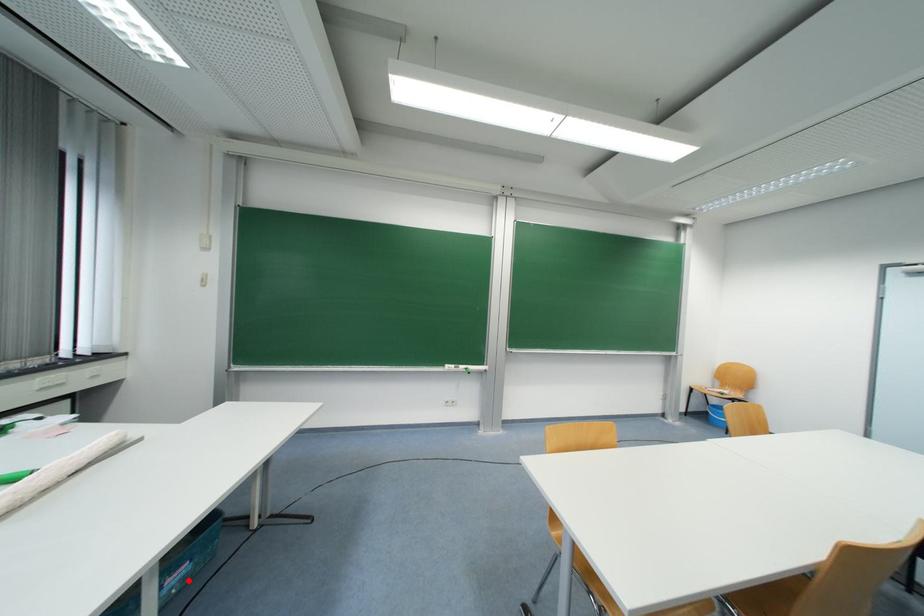
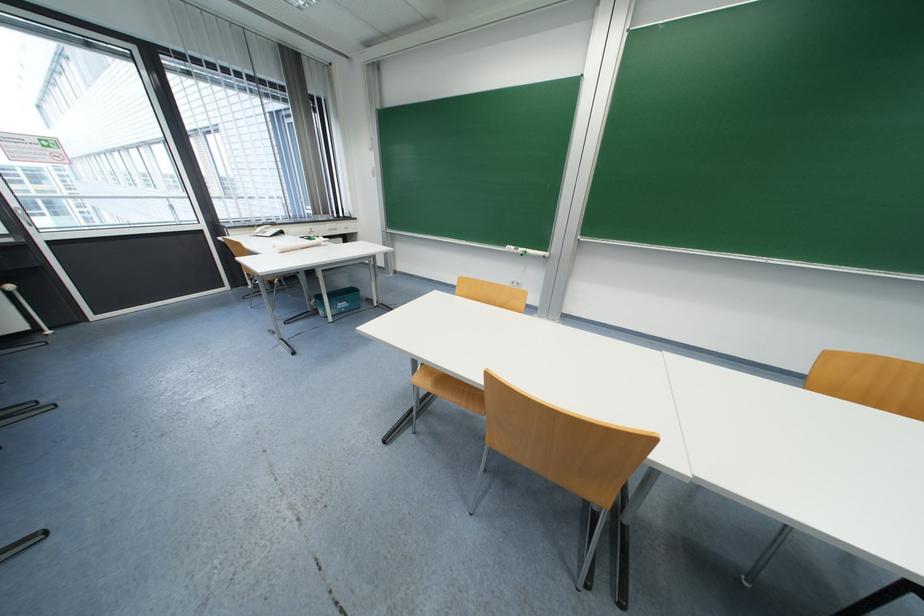
Find the pixel in the second image that matches the highlighted location in the first image.

(350, 310)